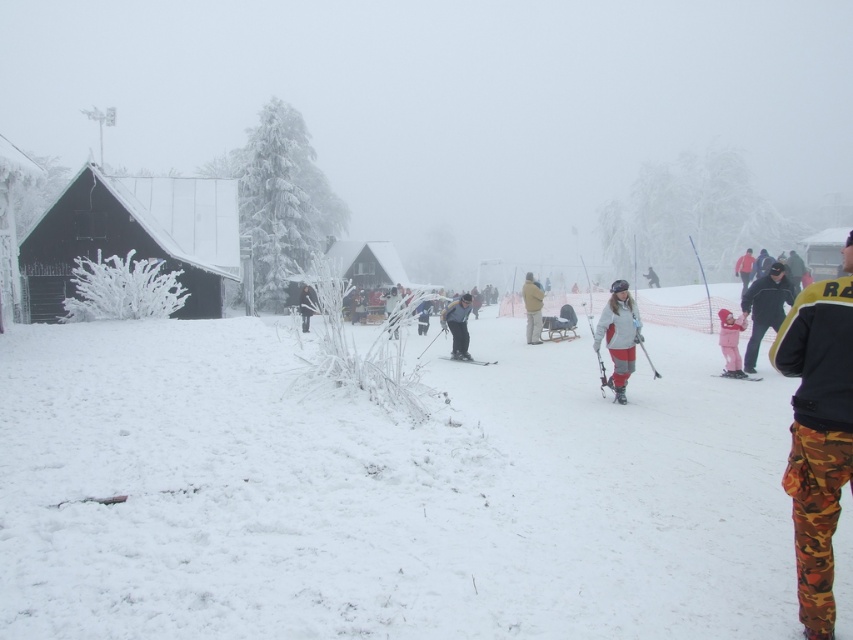
Does matte gray jacket at center have a greater width compared to white snowboarder at center?

No.

Which of these two, matte gray jacket at center or white snowboarder at center, stands taller?

With more height is white snowboarder at center.

The height and width of the screenshot is (640, 853). Identify the location of matte gray jacket at center. (619, 336).

Can you confirm if tan fabric coat at center is shorter than dark gray snowsuit at center?

No.

Locate an element on the screen. tan fabric coat at center is located at coordinates (532, 308).

Can you confirm if matte gray jacket at center is positioned to the left of black matte ski at center?

In fact, matte gray jacket at center is to the right of black matte ski at center.

In the scene shown: Which is more to the left, matte gray jacket at center or black matte ski at center?

From the viewer's perspective, black matte ski at center appears more on the left side.

At what (x,y) coordinates should I click in order to perform the action: click on matte gray jacket at center. Please return your answer as a coordinate pair (x, y). This screenshot has height=640, width=853. Looking at the image, I should click on (619, 336).

The image size is (853, 640). Find the location of `matte gray jacket at center`. matte gray jacket at center is located at coordinates (619, 336).